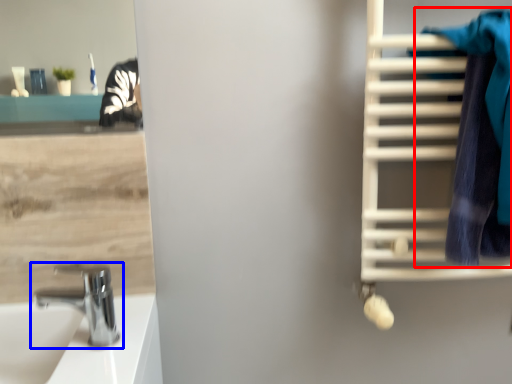
Question: Which point is further to the camera, bath towel (highlighted by a red box) or tap (highlighted by a blue box)?

Choices:
 (A) bath towel
 (B) tap

Answer: (B)